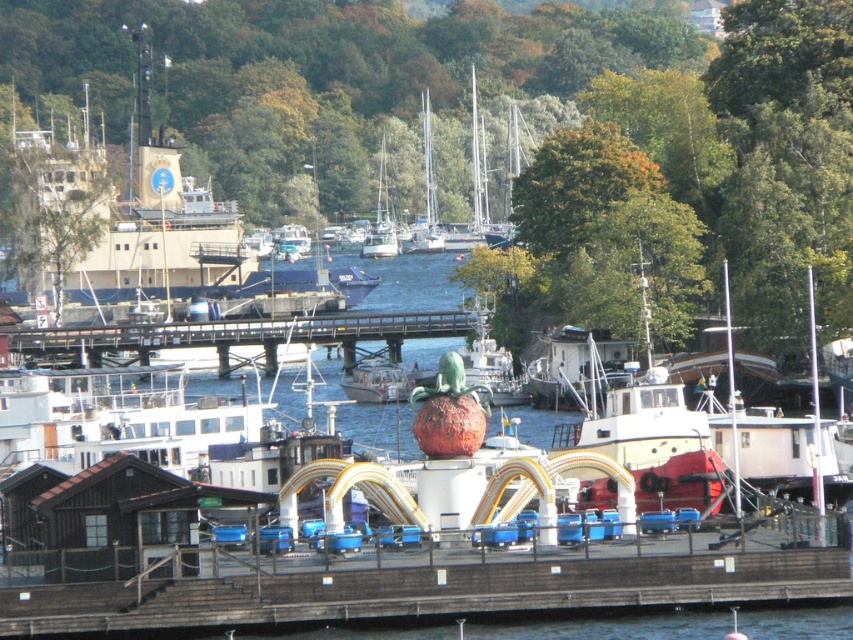
You are a photographer planning to capture the wooden dock at center and the white glossy sailboat at center in a single frame. Given that your camera has a fixed focal length, which object should you prioritize positioning closer to the camera to ensure both fit within the frame?

Since the wooden dock at center is larger in size than the white glossy sailboat at center, you should position the wooden dock at center closer to the camera to ensure both fit within the frame.

You are standing at the waterfront scene described. If you look towards the center of the image, where would you find the brown wooden dock at center?

The brown wooden dock at center is located at the coordinates point (427,593).

You are standing on the wooden dock at center and want to board the white glossy sailboat at center. Can you step directly onto the sailboat from the dock without using a ladder?

The wooden dock at center is not as tall as the white glossy sailboat at center, so you would need a ladder or some form of assistance to board the sailboat from the dock since the dock is lower than the boat.